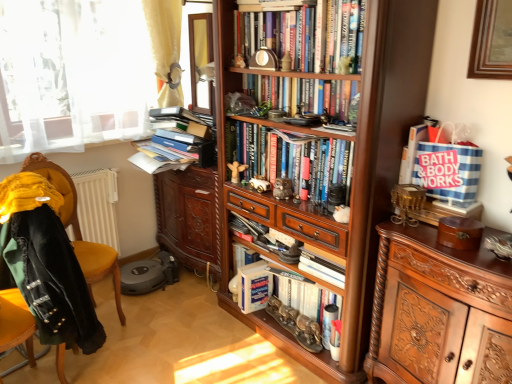
Question: Considering the relative sizes of wooden figurine at center, the 3th toy viewed from the front, and white matte paperback book at center in the image provided, is wooden figurine at center, the 3th toy viewed from the front, bigger than white matte paperback book at center?

Choices:
 (A) no
 (B) yes

Answer: (A)

Question: Can you confirm if wooden figurine at center, which is counted as the first toy, starting from the back, is thinner than white matte paperback book at center?

Choices:
 (A) yes
 (B) no

Answer: (A)

Question: Is wooden figurine at center, which is counted as the first toy, starting from the back, wider than white matte paperback book at center?

Choices:
 (A) yes
 (B) no

Answer: (B)

Question: Considering the relative positions of wooden figurine at center, the 3th toy viewed from the right, and white matte paperback book at center in the image provided, is wooden figurine at center, the 3th toy viewed from the right, behind white matte paperback book at center?

Choices:
 (A) yes
 (B) no

Answer: (B)

Question: Could you tell me if wooden figurine at center, the 3th toy viewed from the right, is turned towards white matte paperback book at center?

Choices:
 (A) no
 (B) yes

Answer: (A)

Question: Is wooden figurine at center, the first toy positioned from the left, to the right of white matte paperback book at center from the viewer's perspective?

Choices:
 (A) no
 (B) yes

Answer: (A)

Question: Is the position of hardcover books at center, the first book positioned from the top, more distant than that of matte brown owl at center, placed as the third toy when sorted from left to right?

Choices:
 (A) yes
 (B) no

Answer: (B)

Question: From the image's perspective, is hardcover books at center, the first book positioned from the top, below matte brown owl at center, which is counted as the 1th toy, starting from the right?

Choices:
 (A) yes
 (B) no

Answer: (B)

Question: From a real-world perspective, is hardcover books at center, the first book positioned from the top, located higher than matte brown owl at center, arranged as the 3th toy when viewed from the back?

Choices:
 (A) no
 (B) yes

Answer: (B)

Question: Can you confirm if hardcover books at center, which is counted as the fifth book, starting from the bottom, is smaller than matte brown owl at center, arranged as the 3th toy when viewed from the back?

Choices:
 (A) yes
 (B) no

Answer: (B)

Question: Considering the relative sizes of hardcover books at center, the first book positioned from the top, and matte brown owl at center, arranged as the 3th toy when viewed from the back, in the image provided, is hardcover books at center, the first book positioned from the top, thinner than matte brown owl at center, arranged as the 3th toy when viewed from the back,?

Choices:
 (A) yes
 (B) no

Answer: (B)

Question: Considering the relative positions of hardcover books at center, which is counted as the fifth book, starting from the bottom, and matte brown owl at center, the 1th toy positioned from the front, in the image provided, is hardcover books at center, which is counted as the fifth book, starting from the bottom, to the right of matte brown owl at center, the 1th toy positioned from the front, from the viewer's perspective?

Choices:
 (A) no
 (B) yes

Answer: (B)

Question: Could you tell me if hardcover books at center, marked as the 4th book in a bottom-to-top arrangement, is facing polished wood cabinet at right?

Choices:
 (A) yes
 (B) no

Answer: (B)